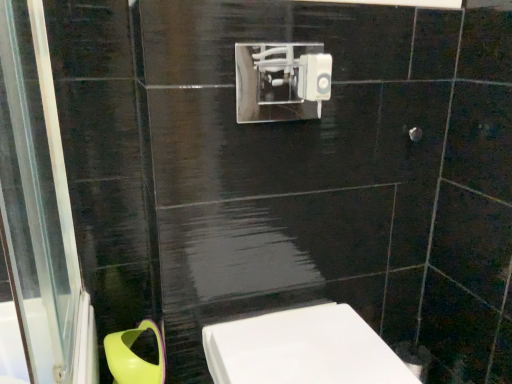
Question: Are white glossy toilet at lower center and green plastic toilet bowl at lower left far apart?

Choices:
 (A) yes
 (B) no

Answer: (B)

Question: Is white glossy toilet at lower center at the left side of green plastic toilet bowl at lower left?

Choices:
 (A) no
 (B) yes

Answer: (A)

Question: Can you confirm if white glossy toilet at lower center is shorter than green plastic toilet bowl at lower left?

Choices:
 (A) no
 (B) yes

Answer: (A)

Question: From the image's perspective, is white glossy toilet at lower center on top of green plastic toilet bowl at lower left?

Choices:
 (A) no
 (B) yes

Answer: (B)

Question: From the image's perspective, is white glossy toilet at lower center under green plastic toilet bowl at lower left?

Choices:
 (A) no
 (B) yes

Answer: (A)

Question: From a real-world perspective, is white glossy toilet at lower center over green plastic toilet bowl at lower left?

Choices:
 (A) no
 (B) yes

Answer: (B)

Question: Does green plastic toilet bowl at lower left have a greater width compared to white glossy toilet at lower center?

Choices:
 (A) yes
 (B) no

Answer: (B)

Question: From a real-world perspective, is green plastic toilet bowl at lower left located higher than white glossy toilet at lower center?

Choices:
 (A) no
 (B) yes

Answer: (A)

Question: Considering the relative sizes of green plastic toilet bowl at lower left and white glossy toilet at lower center in the image provided, is green plastic toilet bowl at lower left shorter than white glossy toilet at lower center?

Choices:
 (A) no
 (B) yes

Answer: (B)

Question: Is green plastic toilet bowl at lower left positioned with its back to white glossy toilet at lower center?

Choices:
 (A) yes
 (B) no

Answer: (B)

Question: Can white glossy toilet at lower center be found inside green plastic toilet bowl at lower left?

Choices:
 (A) no
 (B) yes

Answer: (A)

Question: Considering the relative sizes of green plastic toilet bowl at lower left and white glossy toilet at lower center in the image provided, is green plastic toilet bowl at lower left bigger than white glossy toilet at lower center?

Choices:
 (A) no
 (B) yes

Answer: (A)

Question: From a real-world perspective, is green plastic toilet bowl at lower left above or below white glossy toilet at lower center?

Choices:
 (A) above
 (B) below

Answer: (B)